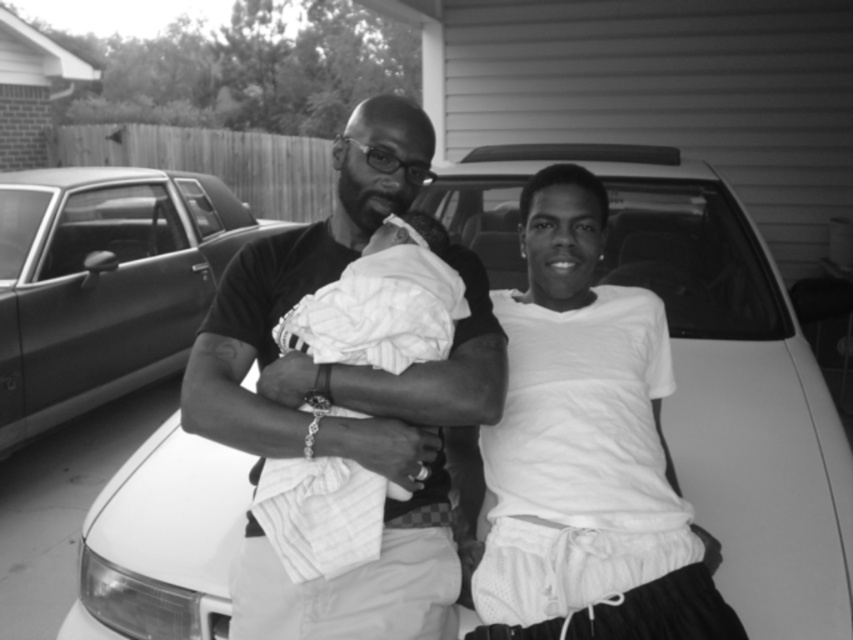
You are a photographer standing at the center of the scene. You want to take a photo of the metallic silver car at left and the white soft cloth at center. How far apart are these two objects in meters?

The metallic silver car at left and white soft cloth at center are 3.71 meters apart from each other.

You are a photographer trying to capture a clear shot of both the white matte car at center and the white soft cloth at center. Since you want both objects in focus, which one should you adjust your camera focus on first?

The white matte car at center is further to the viewer than the white soft cloth at center, so you should focus on the white soft cloth at center first to ensure both are in focus.